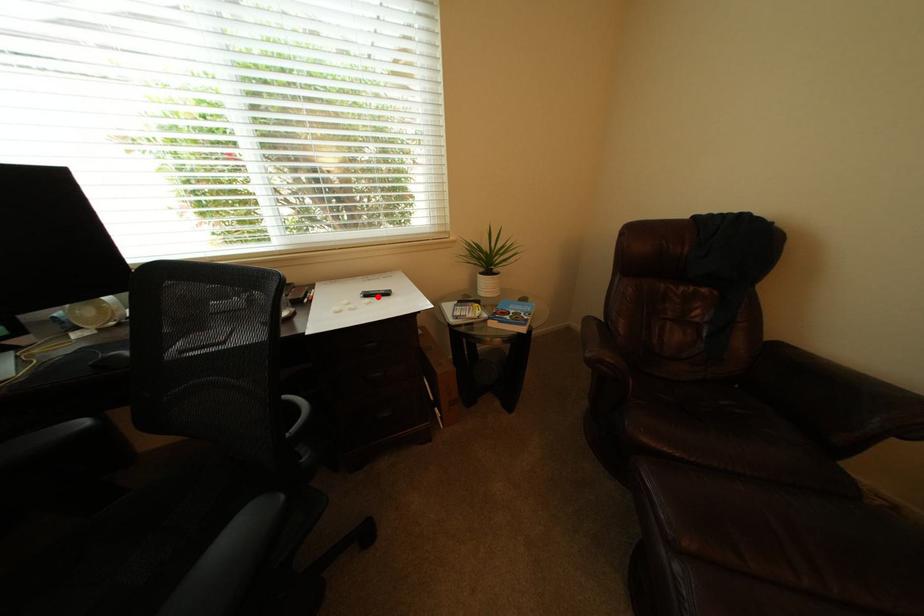
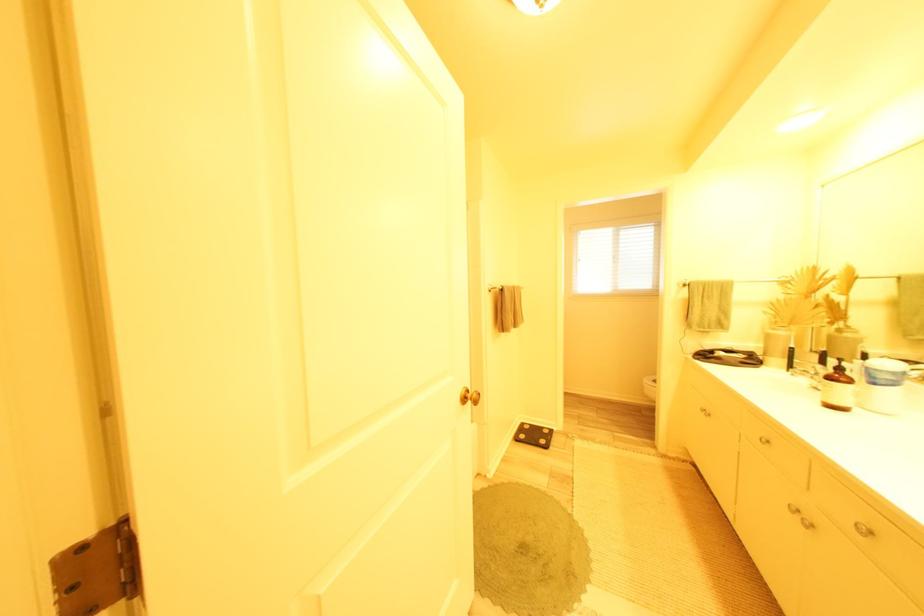
Question: I am providing you with two images of the same scene from different viewpoints. A red point is marked on the first image. Is the red point's position out of view in image 2?

Choices:
 (A) Yes
 (B) No

Answer: (A)